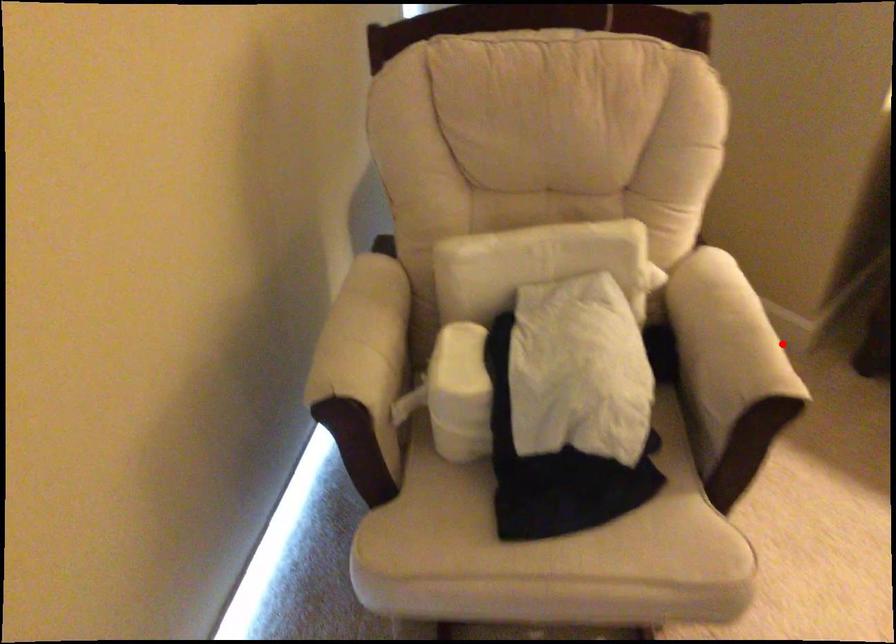
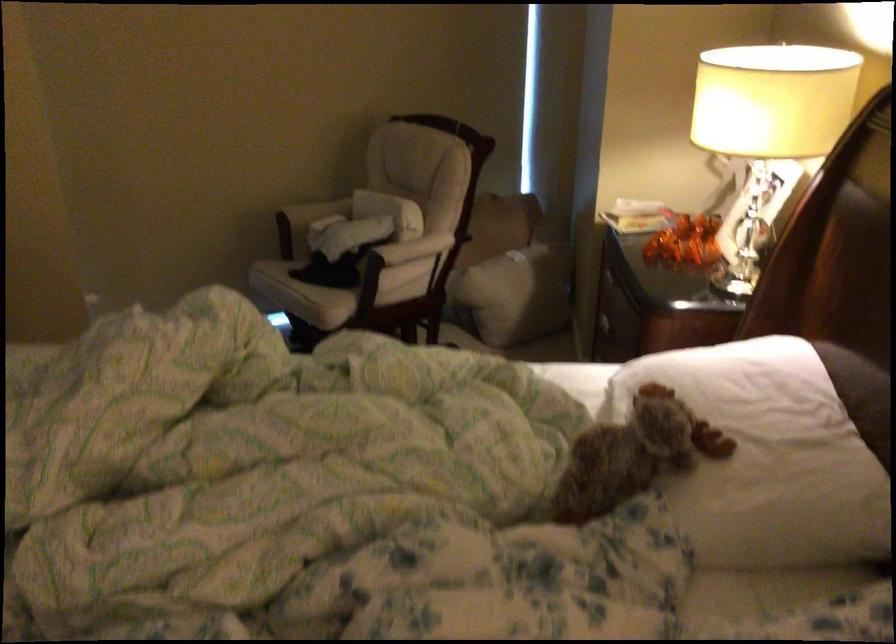
Question: I am providing you with two images of the same scene from different viewpoints. A red point is marked on the first image. Is the red point's position out of view in image 2?

Choices:
 (A) Yes
 (B) No

Answer: (B)